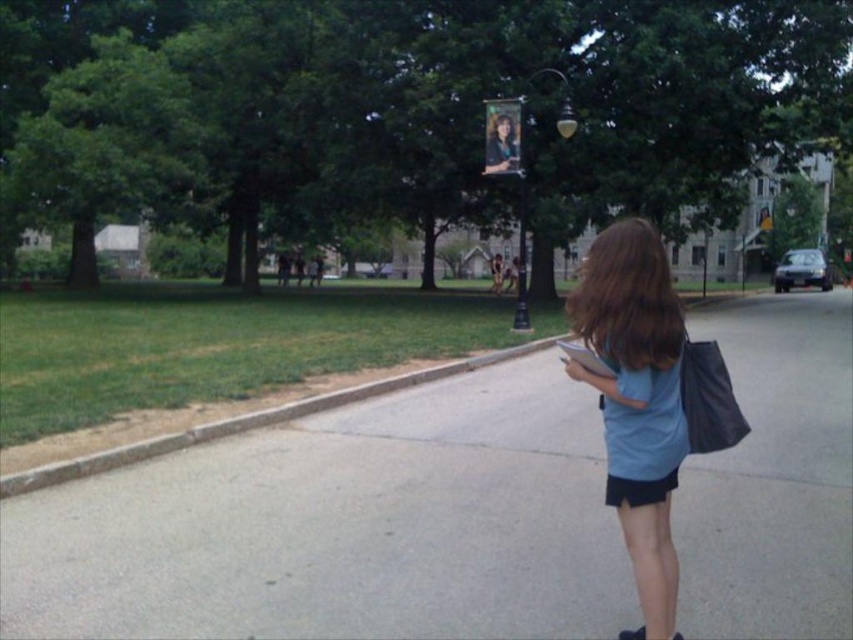
Is point (613, 253) more distant than point (515, 120)?

No, it is in front of (515, 120).

Who is higher up, brown smooth hair at center or brown matte hair at upper center?

Positioned higher is brown matte hair at upper center.

Is point (666, 340) positioned in front of point (491, 124)?

That is True.

Where is `brown smooth hair at center`? brown smooth hair at center is located at coordinates (627, 298).

Which is more to the left, gray asphalt pavement at center or blue fabric shirt at center?

From the viewer's perspective, gray asphalt pavement at center appears more on the left side.

Between gray asphalt pavement at center and blue fabric shirt at center, which one appears on the right side from the viewer's perspective?

From the viewer's perspective, blue fabric shirt at center appears more on the right side.

Is point (341, 500) less distant than point (607, 417)?

No, it is behind (607, 417).

This screenshot has height=640, width=853. Find the location of `gray asphalt pavement at center`. gray asphalt pavement at center is located at coordinates (341, 525).

Which of these two, gray asphalt pavement at center or gray concrete curb at lower left, stands shorter?

gray concrete curb at lower left

Does point (370, 548) come in front of point (235, 417)?

Yes, point (370, 548) is closer to viewer.

What do you see at coordinates (341, 525) in the screenshot? Image resolution: width=853 pixels, height=640 pixels. I see `gray asphalt pavement at center` at bounding box center [341, 525].

Identify the location of gray asphalt pavement at center. The width and height of the screenshot is (853, 640). (341, 525).